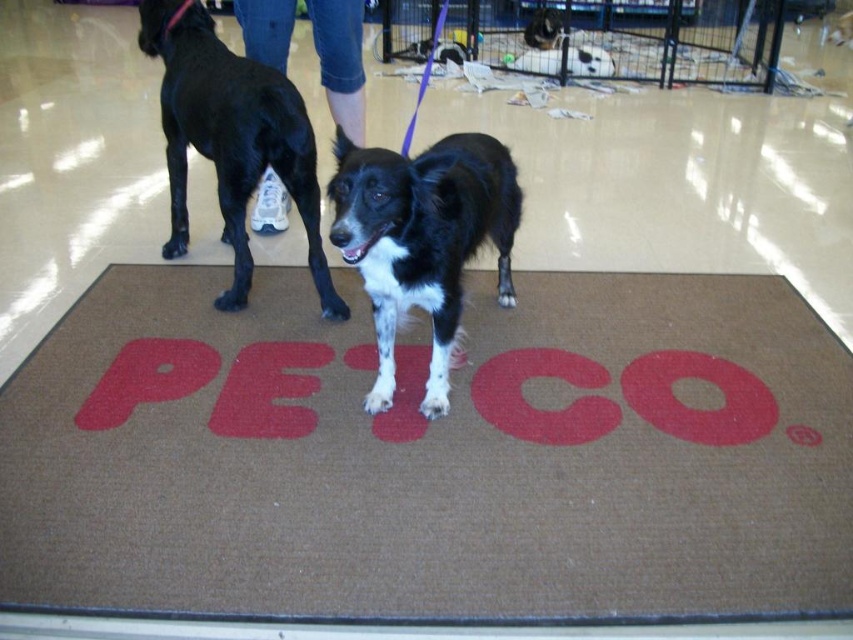
Question: Where is brown textured mat at center located in relation to jeans at center in the image?

Choices:
 (A) right
 (B) left

Answer: (A)

Question: Which object is the farthest from the jeans at center?

Choices:
 (A) black and white fur at center
 (B) brown textured mat at center
 (C) black smooth fur dog at left

Answer: (B)

Question: Is brown textured mat at center below black and white fur at center?

Choices:
 (A) yes
 (B) no

Answer: (A)

Question: Which object is positioned farthest from the black smooth fur dog at left?

Choices:
 (A) brown textured mat at center
 (B) jeans at center
 (C) black and white fur at center

Answer: (C)

Question: Estimate the real-world distances between objects in this image. Which object is farther from the black smooth fur dog at left?

Choices:
 (A) brown textured mat at center
 (B) black and white fur at center

Answer: (B)

Question: Does brown textured mat at center appear on the right side of black and white fur at center?

Choices:
 (A) no
 (B) yes

Answer: (B)